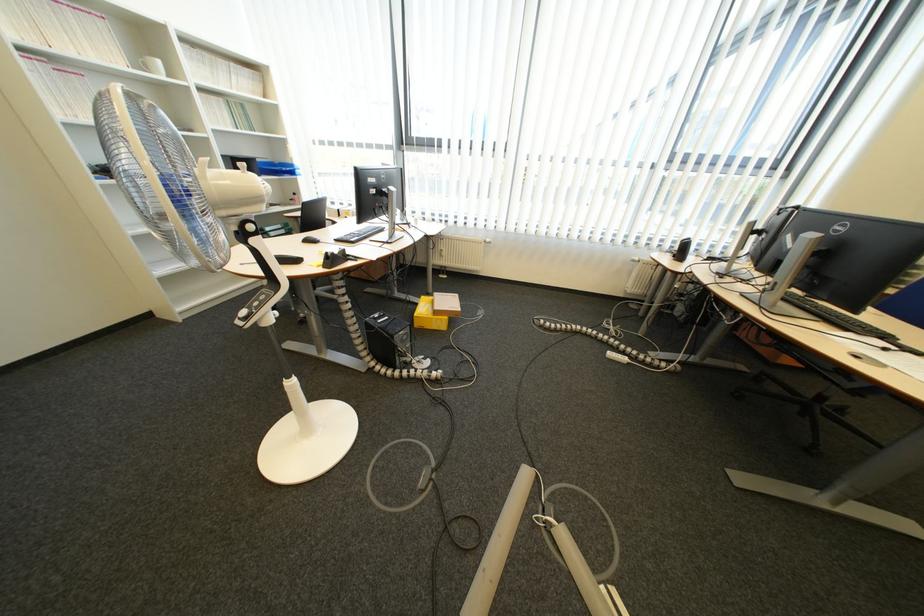
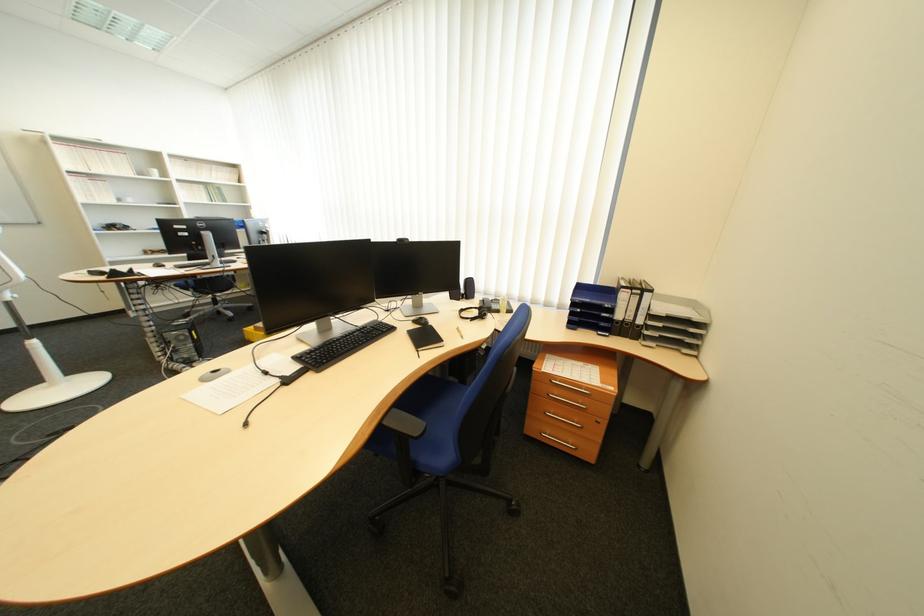
Question: What movement of the cameraman would produce the second image?

Choices:
 (A) Left
 (B) Right
 (C) Forward
 (D) Backward

Answer: (B)